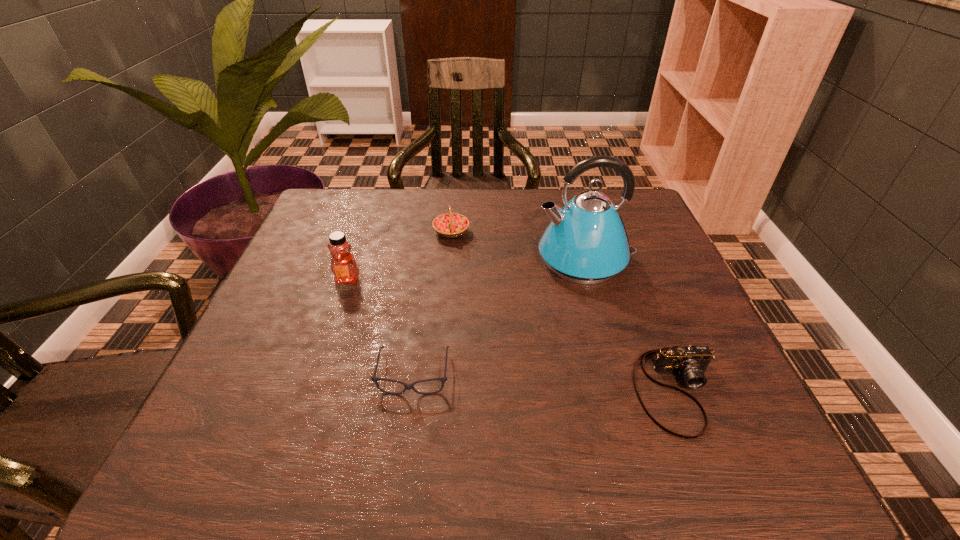
Where is `the tallest object`? The image size is (960, 540). the tallest object is located at coordinates (586, 242).

Find the location of a particular element. honey is located at coordinates (343, 265).

The height and width of the screenshot is (540, 960). In order to click on the second tallest object in this screenshot , I will do `click(343, 265)`.

Locate an element on the screen. the third shortest object is located at coordinates (450, 225).

Where is `camera`? This screenshot has width=960, height=540. camera is located at coordinates (691, 362).

Locate an element on the screen. the shortest object is located at coordinates (443, 379).

The image size is (960, 540). I want to click on free space located at the spout of the tallest object, so click(x=487, y=259).

I want to click on free spot located at the spout of the tallest object, so click(x=462, y=259).

Find the location of a particular element. This screenshot has width=960, height=540. vacant space situated at the spout of the tallest object is located at coordinates (453, 259).

Where is `blank space located on the front label of the honey`? blank space located on the front label of the honey is located at coordinates (332, 323).